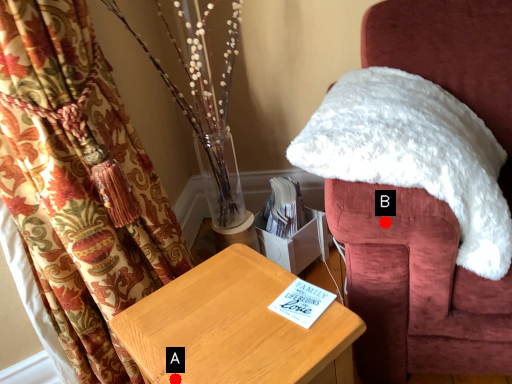
Question: Two points are circled on the image, labeled by A and B beside each circle. Which point is closer to the camera?

Choices:
 (A) A is closer
 (B) B is closer

Answer: (A)